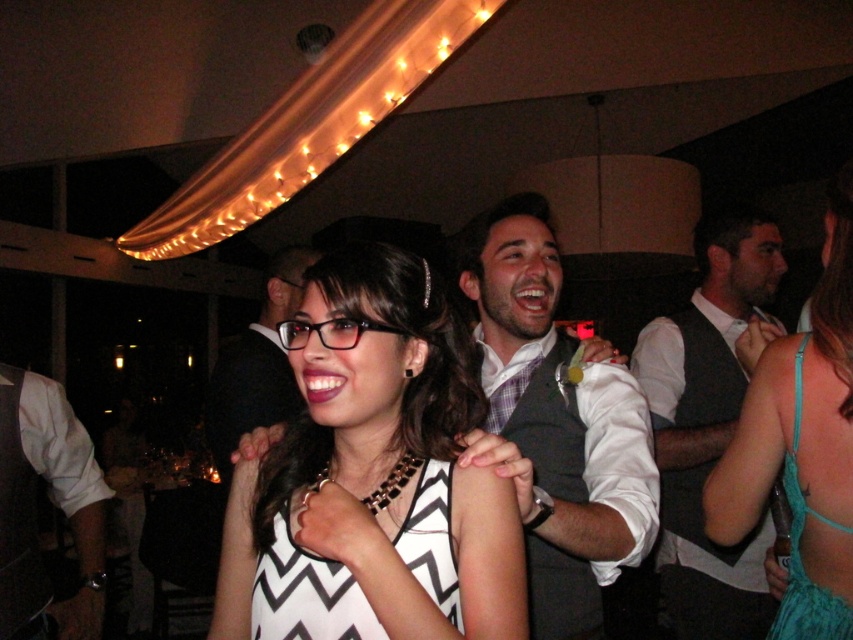
Question: Which point is farther to the camera?

Choices:
 (A) gray fabric vest at upper center
 (B) white shirt at center

Answer: (B)

Question: Is black zigzag dress at center above teal fabric dress at right?

Choices:
 (A) yes
 (B) no

Answer: (B)

Question: Which of the following is the closest to the observer?

Choices:
 (A) (450, 556)
 (B) (685, 481)

Answer: (A)

Question: From the image, what is the correct spatial relationship of gray fabric vest at upper center in relation to white shirt at center?

Choices:
 (A) below
 (B) above

Answer: (B)

Question: Does white zigzag dress at center appear on the right side of dark gray vest at center?

Choices:
 (A) yes
 (B) no

Answer: (B)

Question: Which is nearer to the white zigzag dress at center?

Choices:
 (A) teal fabric dress at right
 (B) black zigzag dress at center

Answer: (B)